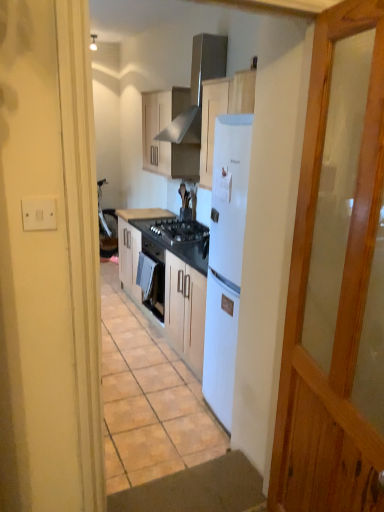
Question: Is matte wood cabinets at center thinner than white plastic switch at upper left?

Choices:
 (A) yes
 (B) no

Answer: (B)

Question: Considering the relative sizes of matte wood cabinets at center and white plastic switch at upper left in the image provided, is matte wood cabinets at center shorter than white plastic switch at upper left?

Choices:
 (A) yes
 (B) no

Answer: (B)

Question: From the image's perspective, is matte wood cabinets at center located above white plastic switch at upper left?

Choices:
 (A) yes
 (B) no

Answer: (A)

Question: Considering the relative sizes of matte wood cabinets at center and white plastic switch at upper left in the image provided, is matte wood cabinets at center smaller than white plastic switch at upper left?

Choices:
 (A) yes
 (B) no

Answer: (B)

Question: Is matte wood cabinets at center positioned before white plastic switch at upper left?

Choices:
 (A) yes
 (B) no

Answer: (B)

Question: Is matte wood cabinets at center facing away from white plastic switch at upper left?

Choices:
 (A) no
 (B) yes

Answer: (A)

Question: Is black laminate countertop at center, positioned as the 2th countertop in bottom-to-top order, not close to stainless steel exhaust hood at upper center?

Choices:
 (A) no
 (B) yes

Answer: (B)

Question: Does black laminate countertop at center, positioned as the 2th countertop in bottom-to-top order, have a greater height compared to stainless steel exhaust hood at upper center?

Choices:
 (A) yes
 (B) no

Answer: (B)

Question: Can you confirm if black laminate countertop at center, positioned as the 2th countertop in bottom-to-top order, is bigger than stainless steel exhaust hood at upper center?

Choices:
 (A) yes
 (B) no

Answer: (B)

Question: Is black laminate countertop at center, positioned as the 2th countertop in bottom-to-top order, positioned with its back to stainless steel exhaust hood at upper center?

Choices:
 (A) no
 (B) yes

Answer: (A)

Question: From a real-world perspective, is black laminate countertop at center, positioned as the 2th countertop in bottom-to-top order, located beneath stainless steel exhaust hood at upper center?

Choices:
 (A) yes
 (B) no

Answer: (A)

Question: Considering the relative sizes of black laminate countertop at center, which is counted as the 1th countertop, starting from the top, and stainless steel exhaust hood at upper center in the image provided, is black laminate countertop at center, which is counted as the 1th countertop, starting from the top, thinner than stainless steel exhaust hood at upper center?

Choices:
 (A) yes
 (B) no

Answer: (B)

Question: Is black granite countertop at center, the first countertop when ordered from bottom to top, placed right next to white plastic switch at upper left?

Choices:
 (A) no
 (B) yes

Answer: (A)